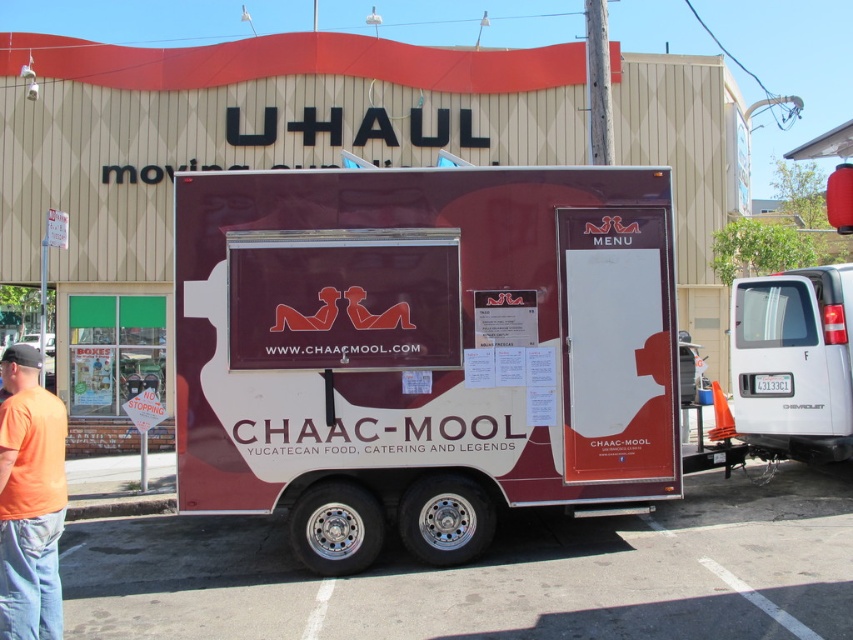
Question: Which point is closer to the camera taking this photo?

Choices:
 (A) tap(335, 448)
 (B) tap(775, 420)
 (C) tap(38, 356)

Answer: (C)

Question: Is white glossy van at right below orange t-shirt at left?

Choices:
 (A) no
 (B) yes

Answer: (A)

Question: Which object is positioned farthest from the white glossy van at right?

Choices:
 (A) orange t-shirt at left
 (B) maroon matte food truck at center

Answer: (A)

Question: From the image, what is the correct spatial relationship of white glossy van at right in relation to orange t-shirt at left?

Choices:
 (A) left
 (B) right

Answer: (B)

Question: Where is maroon matte food truck at center located in relation to orange t-shirt at left in the image?

Choices:
 (A) below
 (B) above

Answer: (B)

Question: Which point is closer to the camera?

Choices:
 (A) (761, 317)
 (B) (44, 572)
 (C) (283, 170)

Answer: (B)